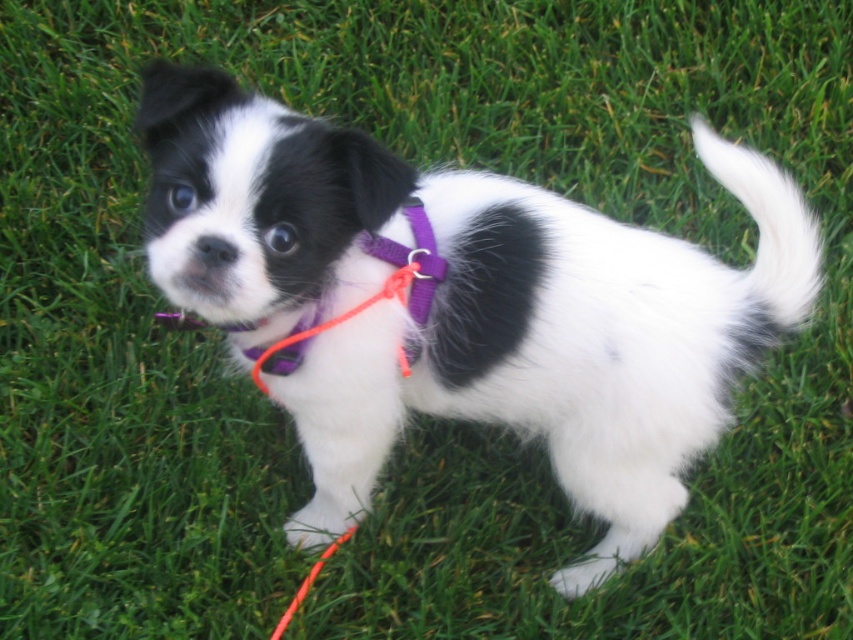
Which is in front, point (177, 100) or point (428, 227)?

Point (177, 100)

Is black and white fur at center positioned in front of purple fabric neckband at center?

Yes, it is.

Is point (350, 428) behind point (277, 353)?

That is True.

The image size is (853, 640). Identify the location of black and white fur at center. (463, 304).